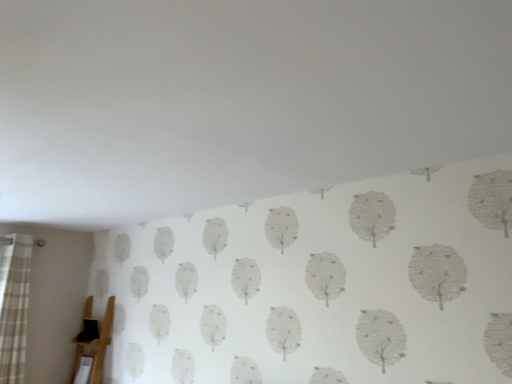
The height and width of the screenshot is (384, 512). Describe the element at coordinates (95, 347) in the screenshot. I see `wooden easel at lower left` at that location.

Find the location of a particular element. The height and width of the screenshot is (384, 512). wooden easel at lower left is located at coordinates (95, 347).

In the scene shown: In order to face plaid fabric curtain at left, should I rotate leftwards or rightwards?

Turn left by 29.464 degrees to look at plaid fabric curtain at left.

Image resolution: width=512 pixels, height=384 pixels. Describe the element at coordinates (14, 305) in the screenshot. I see `plaid fabric curtain at left` at that location.

You are a GUI agent. You are given a task and a screenshot of the screen. Output one action in this format:
    pyautogui.click(x=<x>, y=<y>)
    Task: Click on the plaid fabric curtain at left
    The height and width of the screenshot is (384, 512).
    Given the screenshot: What is the action you would take?
    pyautogui.click(x=14, y=305)

This screenshot has width=512, height=384. In order to click on wooden easel at lower left in this screenshot , I will do `click(95, 347)`.

Does wooden easel at lower left appear on the left side of plaid fabric curtain at left?

No, wooden easel at lower left is not to the left of plaid fabric curtain at left.

Is wooden easel at lower left closer to the viewer compared to plaid fabric curtain at left?

No, wooden easel at lower left is behind plaid fabric curtain at left.

Does point (110, 309) come farther from viewer compared to point (21, 328)?

Yes.

From the image's perspective, which is above, wooden easel at lower left or plaid fabric curtain at left?

plaid fabric curtain at left, from the image's perspective.

From a real-world perspective, between wooden easel at lower left and plaid fabric curtain at left, who is vertically higher?

plaid fabric curtain at left is physically above.

Considering the sizes of objects wooden easel at lower left and plaid fabric curtain at left in the image provided, who is thinner, wooden easel at lower left or plaid fabric curtain at left?

plaid fabric curtain at left.

Between wooden easel at lower left and plaid fabric curtain at left, which one has more height?

plaid fabric curtain at left.

From the picture: Can you confirm if wooden easel at lower left is smaller than plaid fabric curtain at left?

Indeed, wooden easel at lower left has a smaller size compared to plaid fabric curtain at left.

Would you say wooden easel at lower left contains plaid fabric curtain at left?

No, plaid fabric curtain at left is not a part of wooden easel at lower left.

Consider the image. Would you consider wooden easel at lower left to be distant from plaid fabric curtain at left?

wooden easel at lower left is actually quite close to plaid fabric curtain at left.

Is wooden easel at lower left aimed at plaid fabric curtain at left?

Yes, wooden easel at lower left faces towards plaid fabric curtain at left.

How much distance is there between wooden easel at lower left and plaid fabric curtain at left?

22.05 inches.

Where is `curtain above the wooden easel at lower left (from a real-world perspective)`? curtain above the wooden easel at lower left (from a real-world perspective) is located at coordinates (14, 305).

Which object is positioned more to the right, plaid fabric curtain at left or wooden easel at lower left?

wooden easel at lower left is more to the right.

Which object is further away from the camera, plaid fabric curtain at left or wooden easel at lower left?

wooden easel at lower left is more distant.

Does point (20, 321) appear closer or farther from the camera than point (101, 337)?

Point (20, 321) is positioned closer to the camera compared to point (101, 337).

From the image's perspective, is plaid fabric curtain at left under wooden easel at lower left?

No.

Based on the photo, from a real-world perspective, is plaid fabric curtain at left positioned under wooden easel at lower left based on gravity?

Incorrect, from a real-world perspective, plaid fabric curtain at left is higher than wooden easel at lower left.

Does plaid fabric curtain at left have a lesser width compared to wooden easel at lower left?

Indeed, plaid fabric curtain at left has a lesser width compared to wooden easel at lower left.

Can you confirm if plaid fabric curtain at left is taller than wooden easel at lower left?

Correct, plaid fabric curtain at left is much taller as wooden easel at lower left.

Who is bigger, plaid fabric curtain at left or wooden easel at lower left?

Bigger between the two is plaid fabric curtain at left.

Is plaid fabric curtain at left surrounding wooden easel at lower left?

Actually, wooden easel at lower left is outside plaid fabric curtain at left.

Is plaid fabric curtain at left not near wooden easel at lower left?

No, there isn't a large distance between plaid fabric curtain at left and wooden easel at lower left.

Is wooden easel at lower left at the back of plaid fabric curtain at left?

No.

How far apart are plaid fabric curtain at left and wooden easel at lower left?

The distance of plaid fabric curtain at left from wooden easel at lower left is 22.05 inches.

Locate an element on the screen. This screenshot has width=512, height=384. furniture on the right of plaid fabric curtain at left is located at coordinates (95, 347).

The width and height of the screenshot is (512, 384). Find the location of `curtain above the wooden easel at lower left (from the image's perspective)`. curtain above the wooden easel at lower left (from the image's perspective) is located at coordinates (14, 305).

Locate an element on the screen. This screenshot has width=512, height=384. furniture below the plaid fabric curtain at left (from the image's perspective) is located at coordinates (95, 347).